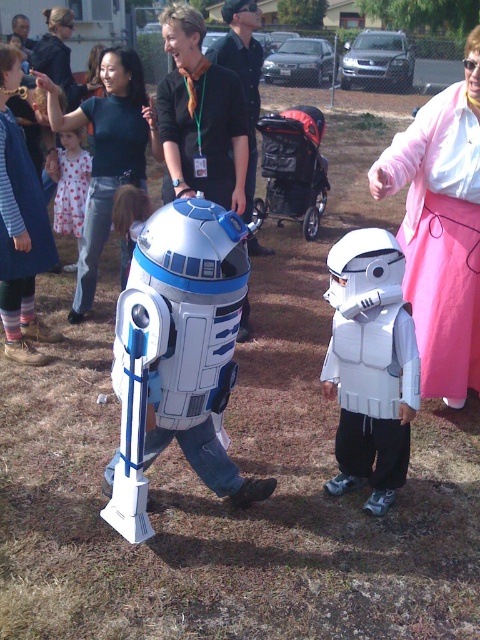
You are standing at the center of the grassy area and want to reach the nearest point between point (x=474, y=115) and point (x=79, y=214). Which point should you walk towards?

Point (x=474, y=115) is closer to the viewer than point (x=79, y=214), so you should walk towards point (x=474, y=115) to reach the nearest point.

You are at an outdoor event and see the white matte helmet at upper right and the polka dot dress at center. Which one is positioned more to the east?

The white matte helmet at upper right is positioned more to the east because it is to the right of the polka dot dress at center, and in the scene, right corresponds to east.